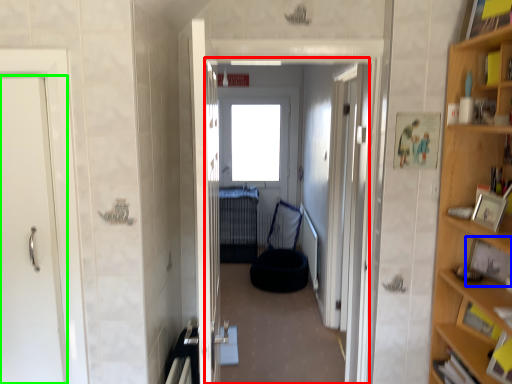
Question: Which object is positioned farthest from corridor (highlighted by a red box)? Select from picture frame (highlighted by a blue box) and door (highlighted by a green box).

Choices:
 (A) picture frame
 (B) door

Answer: (B)